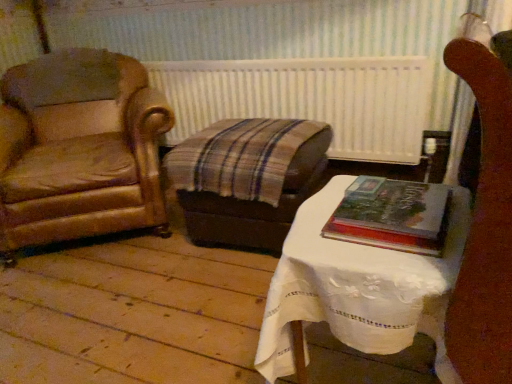
This screenshot has width=512, height=384. Find the location of `white textured radiator at center`. white textured radiator at center is located at coordinates (308, 99).

Locate an element on the screen. hardcover book at center right is located at coordinates (392, 215).

Measure the distance between white lace-covered table at center and camera.

29.41 inches.

I want to click on white textured radiator at center, so click(308, 99).

Which is behind, point (384, 146) or point (412, 195)?

Point (384, 146)

Considering the sizes of objects white textured radiator at center and hardcover book at center right in the image provided, who is thinner, white textured radiator at center or hardcover book at center right?

With smaller width is white textured radiator at center.

At what (x,y) coordinates should I click in order to perform the action: click on book in front of the white textured radiator at center. Please return your answer as a coordinate pair (x, y). The image size is (512, 384). Looking at the image, I should click on (392, 215).

Looking at this image, from the image's perspective, is white lace-covered table at center above or below white textured radiator at center?

white lace-covered table at center is situated lower than white textured radiator at center in the image.

Can you tell me how much white lace-covered table at center and white textured radiator at center differ in facing direction?

There is a 1.76-degree angle between the facing directions of white lace-covered table at center and white textured radiator at center.

Is white textured radiator at center inside white lace-covered table at center?

Definitely not — white textured radiator at center is not inside white lace-covered table at center.

From a real-world perspective, does white lace-covered table at center stand above white textured radiator at center?

No, from a real-world perspective, white lace-covered table at center is not on top of white textured radiator at center.

Does point (88, 48) come behind point (199, 126)?

No.

Consider the image. From the image's perspective, would you say brown leather armchair at left is shown under white textured radiator at center?

Yes, from the image's perspective, brown leather armchair at left is beneath white textured radiator at center.

Is brown leather armchair at left at the left side of white textured radiator at center?

Correct, you'll find brown leather armchair at left to the left of white textured radiator at center.

Considering the relative sizes of brown leather armchair at left and white textured radiator at center in the image provided, is brown leather armchair at left smaller than white textured radiator at center?

Actually, brown leather armchair at left might be larger than white textured radiator at center.

Is white textured radiator at center positioned with its back to brown leather armchair at left?

No, white textured radiator at center is not facing away from brown leather armchair at left.

Is there a large distance between white textured radiator at center and brown leather armchair at left?

That's not correct — white textured radiator at center is a little close to brown leather armchair at left.

Based on the photo, from the image's perspective, which is above, white textured radiator at center or brown leather armchair at left?

white textured radiator at center.

Based on the photo, is the position of white textured radiator at center more distant than that of brown leather armchair at left?

Yes.

From a real-world perspective, does white lace-covered table at center stand above brown leather armchair at left?

Incorrect, from a real-world perspective, white lace-covered table at center is lower than brown leather armchair at left.

What are the coordinates of `table lying below the brown leather armchair at left (from the image's perspective)` in the screenshot? It's located at (358, 288).

Visually, is white lace-covered table at center positioned to the left or to the right of brown leather armchair at left?

From the image, it's evident that white lace-covered table at center is to the right of brown leather armchair at left.

Can you confirm if hardcover book at center right is smaller than white lace-covered table at center?

Correct, hardcover book at center right occupies less space than white lace-covered table at center.

Based on their positions, is hardcover book at center right located to the left or right of white lace-covered table at center?

From the image, it's evident that hardcover book at center right is to the right of white lace-covered table at center.

How many degrees apart are the facing directions of hardcover book at center right and white lace-covered table at center?

The angle between the facing direction of hardcover book at center right and the facing direction of white lace-covered table at center is 1.37 degrees.

Which object is closer to the camera taking this photo, hardcover book at center right or white lace-covered table at center?

white lace-covered table at center is closer to the camera.

Is point (117, 75) less distant than point (446, 304)?

No.

Can you confirm if brown leather armchair at left is smaller than white lace-covered table at center?

Incorrect, brown leather armchair at left is not smaller in size than white lace-covered table at center.

From the image's perspective, is brown leather armchair at left located beneath white lace-covered table at center?

No, from the image's perspective, brown leather armchair at left is not beneath white lace-covered table at center.

Is brown leather armchair at left next to white lace-covered table at center?

brown leather armchair at left and white lace-covered table at center are clearly separated.

At what (x,y) coordinates should I click in order to perform the action: click on book lying below the white textured radiator at center (from the image's perspective). Please return your answer as a coordinate pair (x, y). This screenshot has height=384, width=512. Looking at the image, I should click on pyautogui.click(x=392, y=215).

Where is `table in front of the white textured radiator at center`? This screenshot has height=384, width=512. table in front of the white textured radiator at center is located at coordinates (x=358, y=288).

Looking at this image, from the image, which object appears to be farther from white lace-covered table at center, hardcover book at center right or brown leather armchair at left?

brown leather armchair at left is further to white lace-covered table at center.

Looking at the image, which one is located closer to hardcover book at center right, white lace-covered table at center or brown leather armchair at left?

white lace-covered table at center is positioned closer to the anchor hardcover book at center right.

Based on their spatial positions, is brown leather armchair at left or white lace-covered table at center further from hardcover book at center right?

brown leather armchair at left is positioned further to the anchor hardcover book at center right.

Looking at the image, which one is located further to brown leather armchair at left, white lace-covered table at center or white textured radiator at center?

white lace-covered table at center.

Which object lies nearer to the anchor point white textured radiator at center, brown leather armchair at left or hardcover book at center right?

Based on the image, brown leather armchair at left appears to be nearer to white textured radiator at center.

Estimate the real-world distances between objects in this image. Which object is closer to brown leather armchair at left, hardcover book at center right or white textured radiator at center?

The object closer to brown leather armchair at left is white textured radiator at center.

When comparing their distances from white textured radiator at center, does hardcover book at center right or brown leather armchair at left seem further?

Based on the image, hardcover book at center right appears to be further to white textured radiator at center.

Considering their positions, is brown leather armchair at left positioned closer to white textured radiator at center than white lace-covered table at center?

brown leather armchair at left.

Find the location of a particular element. This screenshot has height=384, width=512. radiator between brown leather armchair at left and hardcover book at center right is located at coordinates (308, 99).

At what (x,y) coordinates should I click in order to perform the action: click on radiator between brown leather armchair at left and white lace-covered table at center in the horizontal direction. Please return your answer as a coordinate pair (x, y). Looking at the image, I should click on (308, 99).

In order to click on book positioned between white lace-covered table at center and white textured radiator at center from near to far in this screenshot , I will do `click(392, 215)`.

Where is `table situated between brown leather armchair at left and hardcover book at center right from left to right`? The image size is (512, 384). table situated between brown leather armchair at left and hardcover book at center right from left to right is located at coordinates (358, 288).